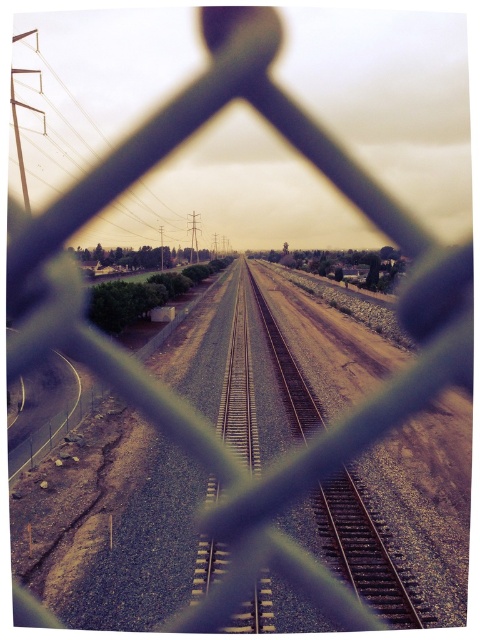
Is rusty metal train track at center thinner than metallic silver power line at upper left?

Correct, rusty metal train track at center's width is less than metallic silver power line at upper left's.

At what (x,y) coordinates should I click in order to perform the action: click on rusty metal train track at center. Please return your answer as a coordinate pair (x, y). Looking at the image, I should click on (361, 552).

At what (x,y) coordinates should I click in order to perform the action: click on rusty metal train track at center. Please return your answer as a coordinate pair (x, y). Looking at the image, I should click on (361, 552).